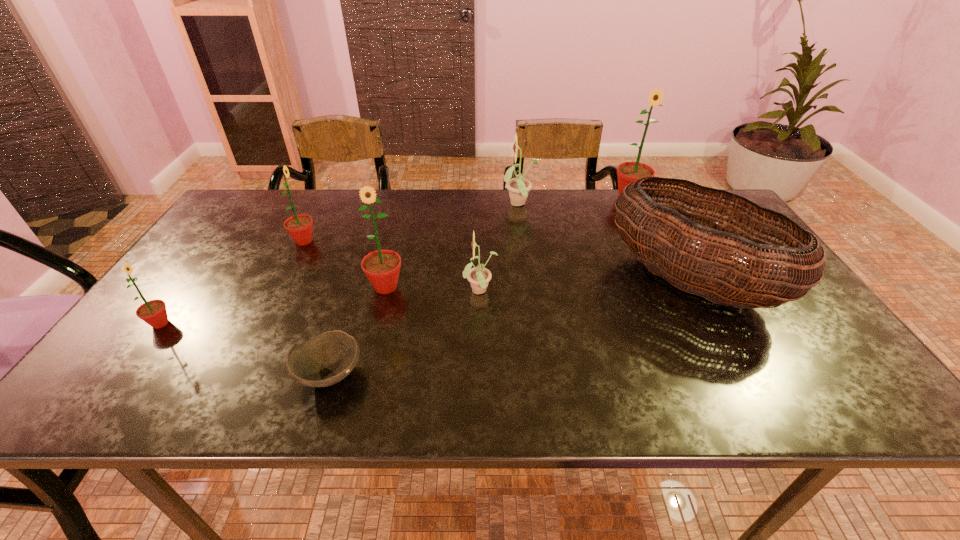
The image size is (960, 540). I want to click on unoccupied position between the nearest sunflower and the sixth object from left to right, so click(x=340, y=264).

At what (x,y) coordinates should I click in order to perform the action: click on free spot between the fourth nearest sunflower and the basket. Please return your answer as a coordinate pair (x, y). Looking at the image, I should click on (497, 261).

Identify which object is the nearest to the second biggest green sunflower. Please provide its 2D coordinates. Your answer should be formatted as a tuple, i.e. [(x, y)], where the tuple contains the x and y coordinates of a point satisfying the conditions above.

[(479, 276)]

Identify the location of object that is the fifth closest to the tallest object. (326, 359).

Identify which sunflower is the fourth closest to the second nearest green sunflower. Please provide its 2D coordinates. Your answer should be formatted as a tuple, i.e. [(x, y)], where the tuple contains the x and y coordinates of a point satisfying the conditions above.

[(153, 312)]

The height and width of the screenshot is (540, 960). Find the location of `sunflower that is the second closest to the rightmost sunflower`. sunflower that is the second closest to the rightmost sunflower is located at coordinates (479, 276).

Select which green sunflower appears as the second closest to the biggest green sunflower. Please provide its 2D coordinates. Your answer should be formatted as a tuple, i.e. [(x, y)], where the tuple contains the x and y coordinates of a point satisfying the conditions above.

[(299, 227)]

The height and width of the screenshot is (540, 960). I want to click on green sunflower identified as the third closest to the bowl, so click(x=299, y=227).

Where is `vacant space that satisfies the following two spatial constraints: 1. on the face of the nearest sunflower; 2. on the right side of the shortest object`? The height and width of the screenshot is (540, 960). vacant space that satisfies the following two spatial constraints: 1. on the face of the nearest sunflower; 2. on the right side of the shortest object is located at coordinates (123, 374).

Where is `vacant area in the image that satisfies the following two spatial constraints: 1. on the face of the brown basket; 2. on the right side of the rightmost sunflower`? The image size is (960, 540). vacant area in the image that satisfies the following two spatial constraints: 1. on the face of the brown basket; 2. on the right side of the rightmost sunflower is located at coordinates (670, 281).